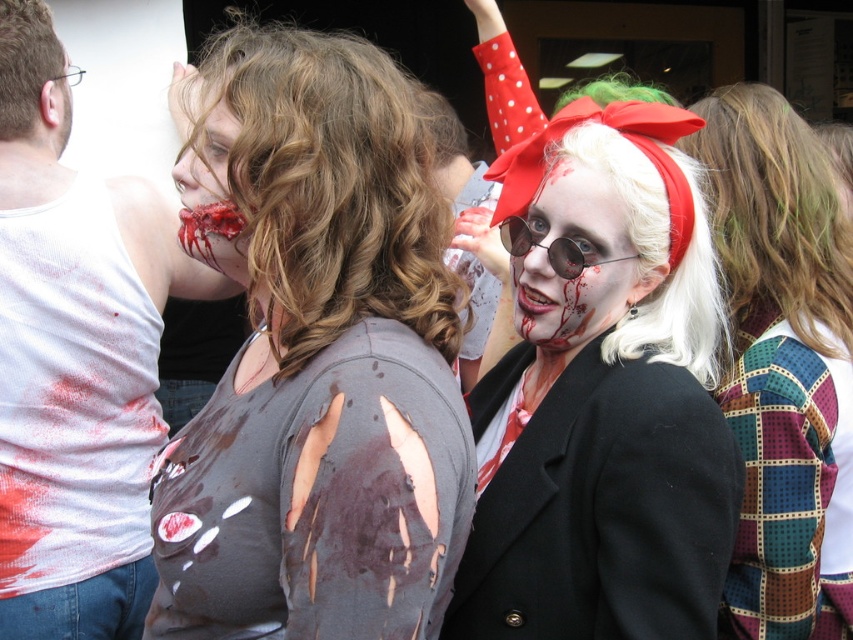
Question: Can you confirm if multicolored patchwork scarf at upper right is positioned to the right of sunglasses at center?

Choices:
 (A) no
 (B) yes

Answer: (B)

Question: Is multicolored patchwork shirt at center positioned behind bloodied skin at center?

Choices:
 (A) no
 (B) yes

Answer: (B)

Question: Which of the following is the closest to the observer?

Choices:
 (A) ripped gray shirt at center
 (B) white matte wig at center
 (C) multicolored patchwork scarf at upper right
 (D) sunglasses at center

Answer: (A)

Question: Which of the following is the farthest from the observer?

Choices:
 (A) (541, 186)
 (B) (669, 385)

Answer: (A)

Question: Which object is farther from the camera taking this photo?

Choices:
 (A) multicolored patchwork scarf at upper right
 (B) white matte wig at center

Answer: (A)

Question: Can you confirm if white matte wig at center is positioned below bloodied skin at center?

Choices:
 (A) no
 (B) yes

Answer: (B)